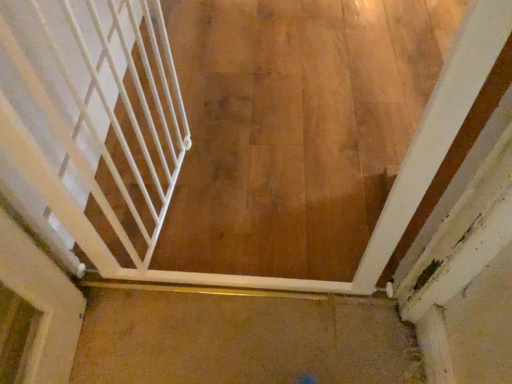
The width and height of the screenshot is (512, 384). What do you see at coordinates (93, 120) in the screenshot?
I see `white plastic gate at left` at bounding box center [93, 120].

Measure the distance between point (57,114) and camera.

Point (57,114) is 3.49 feet away from camera.

At what (x,y) coordinates should I click in order to perform the action: click on white plastic gate at left. Please return your answer as a coordinate pair (x, y). This screenshot has width=512, height=384. Looking at the image, I should click on click(93, 120).

The width and height of the screenshot is (512, 384). In order to click on white plastic gate at left in this screenshot , I will do `click(93, 120)`.